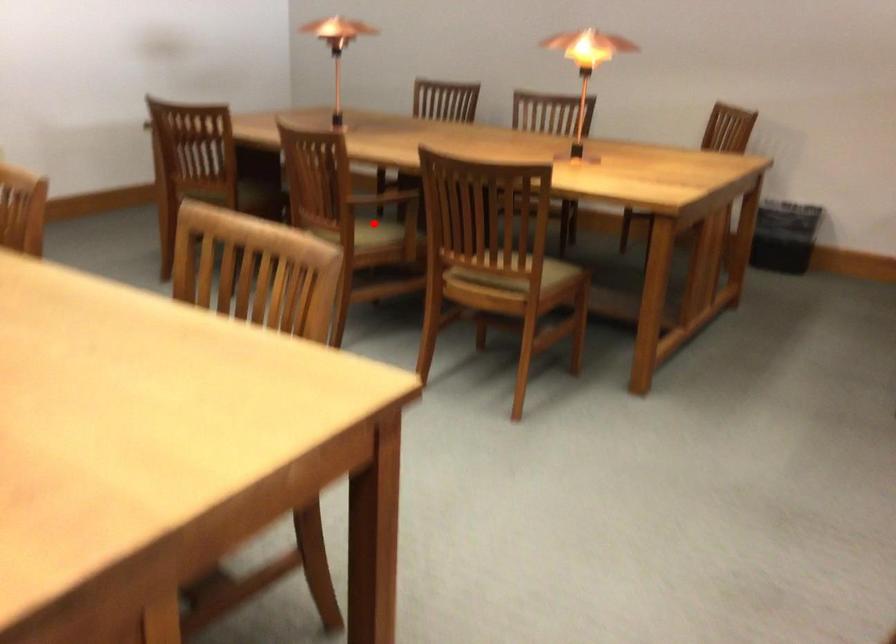
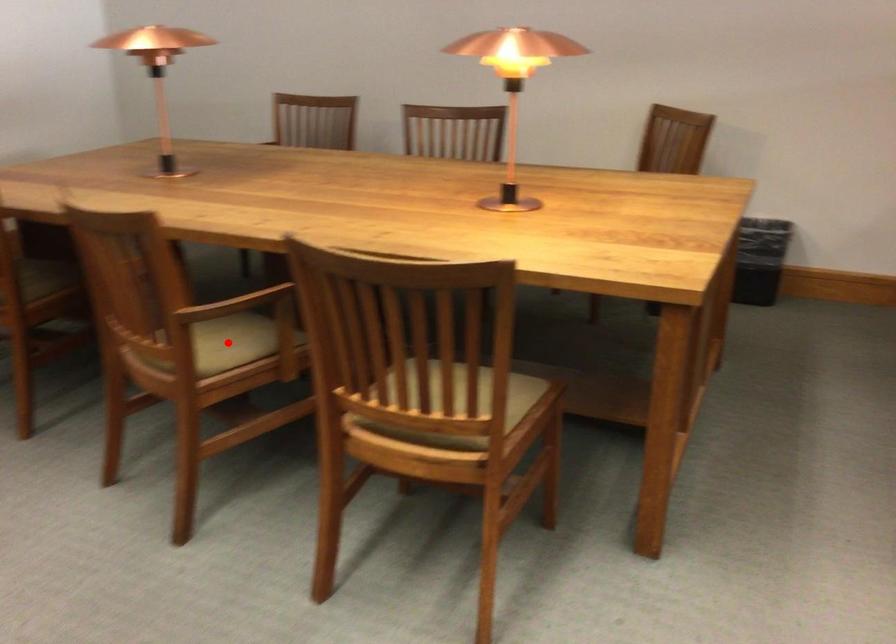
I am providing you with two images of the same scene from different viewpoints. A red point is marked on the first image and another point is marked on the second image. Are the points marked in image1 and image2 representing the same 3D position?

Yes